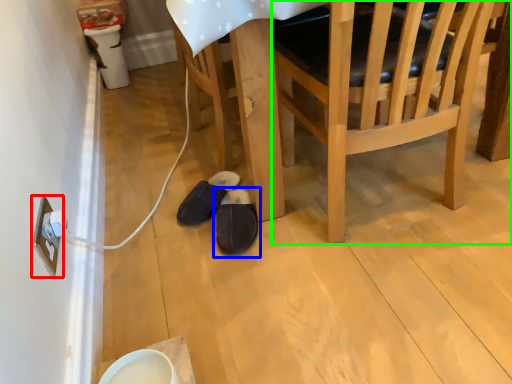
Question: Which is nearer to the electric outlet (highlighted by a red box)? footwear (highlighted by a blue box) or chair (highlighted by a green box).

Choices:
 (A) footwear
 (B) chair

Answer: (A)